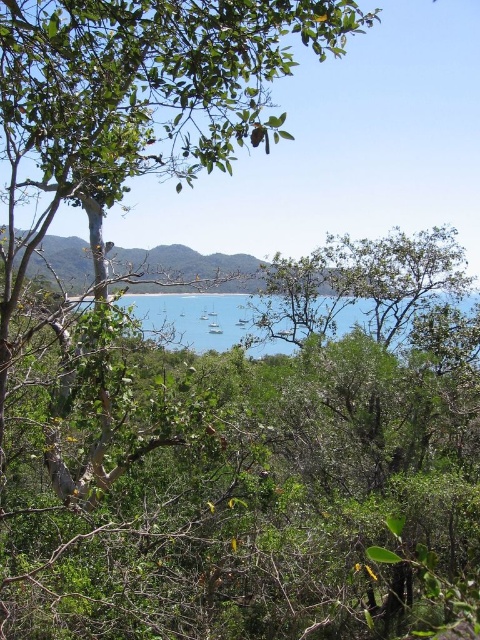
Question: Among these objects, which one is farthest from the camera?

Choices:
 (A) blue water at center
 (B) green leafy tree at upper left

Answer: (A)

Question: Does green leafy tree at upper left have a larger size compared to blue water at center?

Choices:
 (A) yes
 (B) no

Answer: (B)

Question: Which point appears closest to the camera in this image?

Choices:
 (A) (222, 308)
 (B) (144, 113)

Answer: (B)

Question: Can you confirm if green leafy tree at upper left is positioned to the left of blue water at center?

Choices:
 (A) yes
 (B) no

Answer: (A)

Question: Can you confirm if green leafy tree at upper left is smaller than blue water at center?

Choices:
 (A) yes
 (B) no

Answer: (A)

Question: Which point is closer to the camera?

Choices:
 (A) green leafy tree at upper left
 (B) blue water at center

Answer: (A)